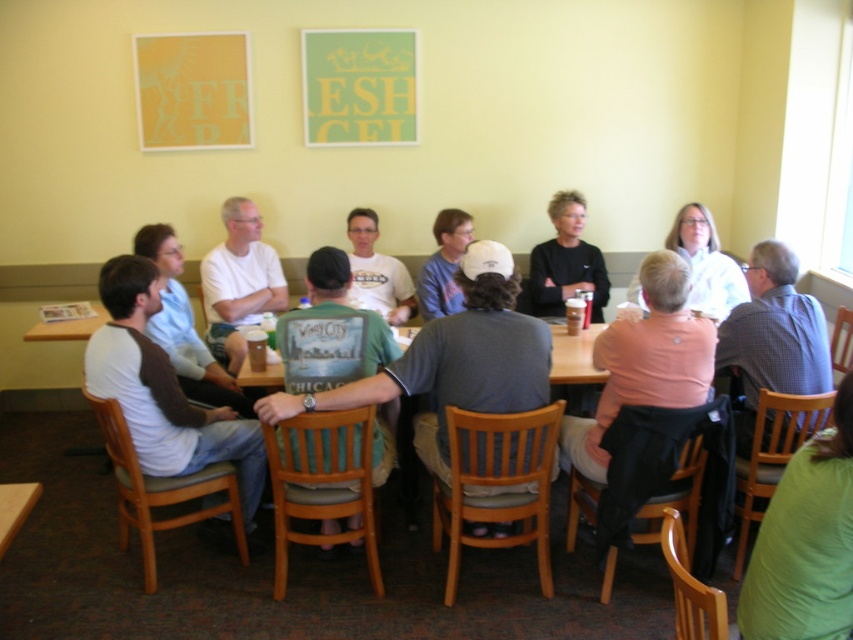
You are sitting at the long wooden table and want to hand a document to the person wearing the white matte shirt at upper center and the matte gray shirt at center. Since you are at the same table, which person is closer to you?

The white matte shirt at upper center is closer to you because it is in front of the matte gray shirt at center.

You are organizing a photo shoot and need to ensure that the green fabric shirt at lower right and the white matte shirt at upper center are visible in the frame. Based on their sizes, which shirt might require more careful framing to avoid being cropped out?

The green fabric shirt at lower right has a lesser width compared to the white matte shirt at upper center, so it might require more careful framing to avoid being cropped out due to its smaller size.